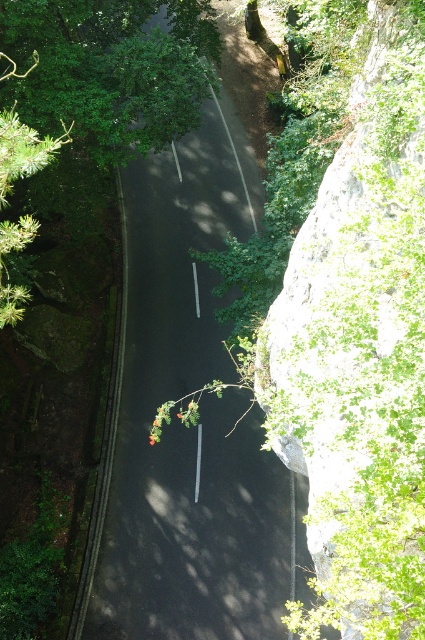
You are driving a car with a length of 4.5 meters. You see the point at coordinate (206, 531). Can you determine if your car can fit entirely behind this point?

The point at coordinate (206, 531) is 18.71 meters from the camera. Since the car is only 4.5 meters long, it can easily fit entirely behind this point as there is sufficient space.

You are driving a car with a width of 2 meters. The road you are on is the black asphalt road at center. There is a green leafy tree at upper left nearby. Can your car safely pass through the road without hitting the tree?

The black asphalt road at center has a larger size compared to green leafy tree at upper left, so the car can safely pass through the road without hitting the tree since the road is wider than the tree.

You are driving a delivery truck that is 20 feet long. You need to make a U turn on the black asphalt road at center. The nearest object is the green leafy tree at upper left. Is there enough space between the road and the tree to complete the U turn?

The distance between the black asphalt road at center and the green leafy tree at upper left is 21.18 feet. Since the truck is 20 feet long, there is sufficient space to complete the U turn as the distance is greater than the truck length.